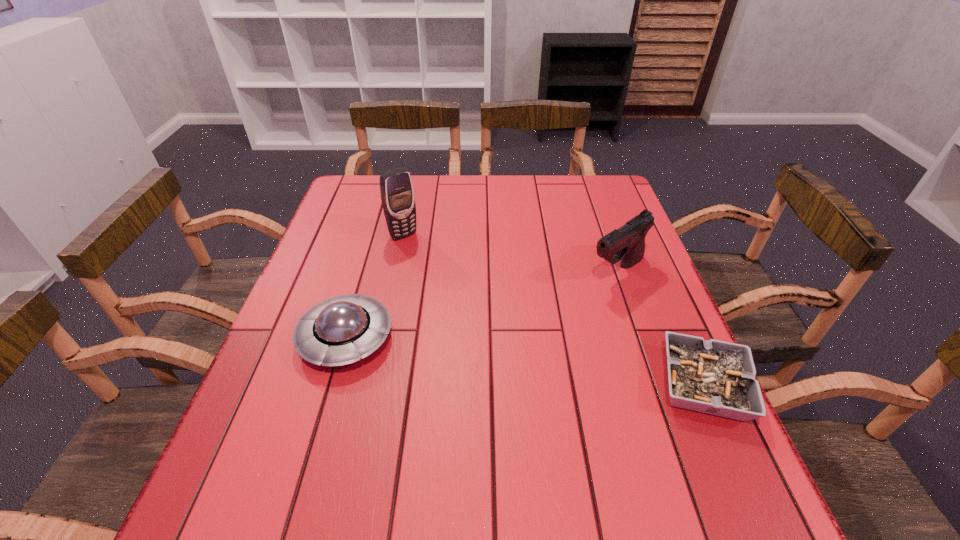
Where is `free space located 0.220m on the front face of the farthest object`? The width and height of the screenshot is (960, 540). free space located 0.220m on the front face of the farthest object is located at coordinates (452, 286).

Where is `vacant space located 0.140m at the barrel of the pistol`? Image resolution: width=960 pixels, height=540 pixels. vacant space located 0.140m at the barrel of the pistol is located at coordinates (560, 312).

Identify the location of vacant space located at the barrel of the pistol. This screenshot has width=960, height=540. (524, 339).

Image resolution: width=960 pixels, height=540 pixels. Identify the location of free region located 0.260m at the barrel of the pistol. (524, 339).

Image resolution: width=960 pixels, height=540 pixels. What are the coordinates of `object situated at the near edge` in the screenshot? It's located at (715, 377).

Locate an element on the screen. object present at the left edge is located at coordinates (338, 331).

Find the location of a particular element. Image resolution: width=960 pixels, height=540 pixels. ashtray that is at the right edge is located at coordinates (715, 377).

Locate an element on the screen. pistol at the right edge is located at coordinates (627, 243).

This screenshot has height=540, width=960. I want to click on object that is at the near right corner, so click(x=715, y=377).

At what (x,y) coordinates should I click in order to perform the action: click on blank space at the far edge of the desktop. Please return your answer as a coordinate pair (x, y). The width and height of the screenshot is (960, 540). Looking at the image, I should click on (550, 193).